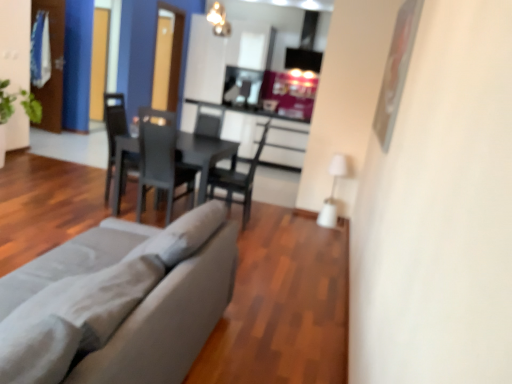
Question: Is matte gray chair at center, the second chair positioned from the left, positioned beyond the bounds of matte black chair at center, marked as the first chair in a left-to-right arrangement?

Choices:
 (A) yes
 (B) no

Answer: (A)

Question: Can you confirm if matte gray chair at center, which appears as the 1th chair when viewed from the right, is positioned to the right of matte black chair at center, the 2th chair positioned from the right?

Choices:
 (A) no
 (B) yes

Answer: (B)

Question: Could you tell me if matte gray chair at center, the second chair positioned from the left, is facing matte black chair at center, the 2th chair positioned from the right?

Choices:
 (A) no
 (B) yes

Answer: (B)

Question: Does matte gray chair at center, the second chair positioned from the left, have a smaller size compared to matte black chair at center, the 2th chair positioned from the right?

Choices:
 (A) no
 (B) yes

Answer: (A)

Question: From the image's perspective, is matte gray chair at center, which appears as the 1th chair when viewed from the right, above matte black chair at center, the 2th chair positioned from the right?

Choices:
 (A) yes
 (B) no

Answer: (B)

Question: Can you see matte gray chair at center, the second chair positioned from the left, touching matte black chair at center, the 2th chair positioned from the right?

Choices:
 (A) no
 (B) yes

Answer: (A)

Question: Considering the relative sizes of matte black chair at center, marked as the first chair in a left-to-right arrangement, and black matte table at center in the image provided, is matte black chair at center, marked as the first chair in a left-to-right arrangement, shorter than black matte table at center?

Choices:
 (A) yes
 (B) no

Answer: (B)

Question: Would you say matte black chair at center, marked as the first chair in a left-to-right arrangement, contains black matte table at center?

Choices:
 (A) yes
 (B) no

Answer: (B)

Question: Could you tell me if matte black chair at center, the 2th chair positioned from the right, is facing black matte table at center?

Choices:
 (A) yes
 (B) no

Answer: (A)

Question: Does matte black chair at center, marked as the first chair in a left-to-right arrangement, have a greater height compared to black matte table at center?

Choices:
 (A) yes
 (B) no

Answer: (A)

Question: Is matte black chair at center, marked as the first chair in a left-to-right arrangement, smaller than black matte table at center?

Choices:
 (A) no
 (B) yes

Answer: (B)

Question: From the image's perspective, would you say matte black chair at center, the 2th chair positioned from the right, is positioned over black matte table at center?

Choices:
 (A) no
 (B) yes

Answer: (B)

Question: Does transparent glass door at upper left, positioned as the 1th glass door in right-to-left order, appear on the right side of black matte table at center?

Choices:
 (A) yes
 (B) no

Answer: (B)